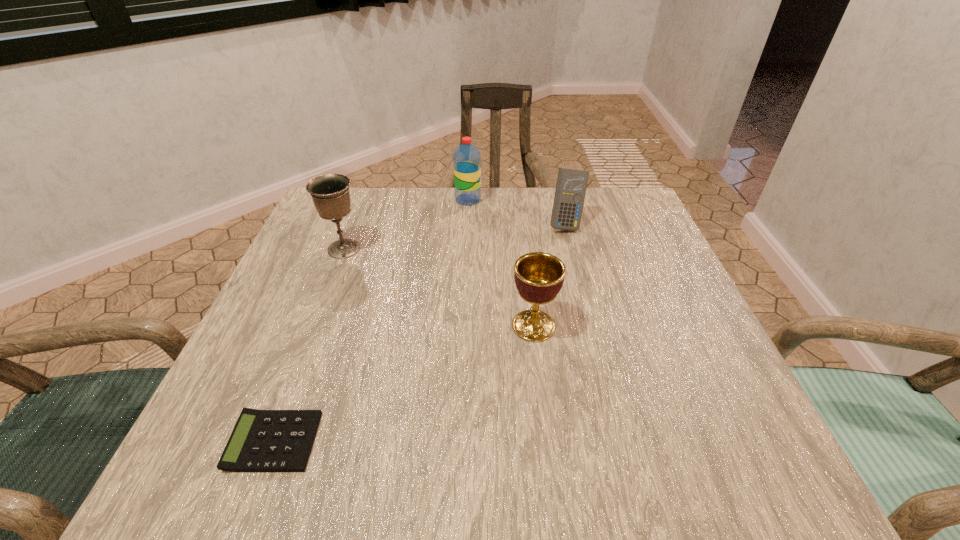
Image resolution: width=960 pixels, height=540 pixels. I want to click on blank region between the third object from right to left and the fourth farthest object, so click(501, 262).

Locate an element on the screen. free spot between the left calculator and the second farthest object is located at coordinates (420, 333).

Find the location of a particular element. Image resolution: width=960 pixels, height=540 pixels. free space between the farther chalice and the farthest object is located at coordinates (406, 224).

The width and height of the screenshot is (960, 540). In order to click on vacant space that is in between the left chalice and the third object from left to right in this screenshot , I will do `click(406, 224)`.

At what (x,y) coordinates should I click in order to perform the action: click on free space between the third object from left to right and the shorter chalice. Please return your answer as a coordinate pair (x, y). Looking at the image, I should click on (501, 262).

Where is `empty location between the left calculator and the rightmost object`? The height and width of the screenshot is (540, 960). empty location between the left calculator and the rightmost object is located at coordinates pyautogui.click(x=420, y=333).

At what (x,y) coordinates should I click in order to perform the action: click on empty space between the water bottle and the farther calculator. Please return your answer as a coordinate pair (x, y). Looking at the image, I should click on (516, 212).

I want to click on free space that is in between the nearer chalice and the water bottle, so click(x=501, y=262).

This screenshot has height=540, width=960. I want to click on empty location between the third object from right to left and the right calculator, so click(x=516, y=212).

The height and width of the screenshot is (540, 960). Identify the location of the third closest object to the left calculator. (466, 159).